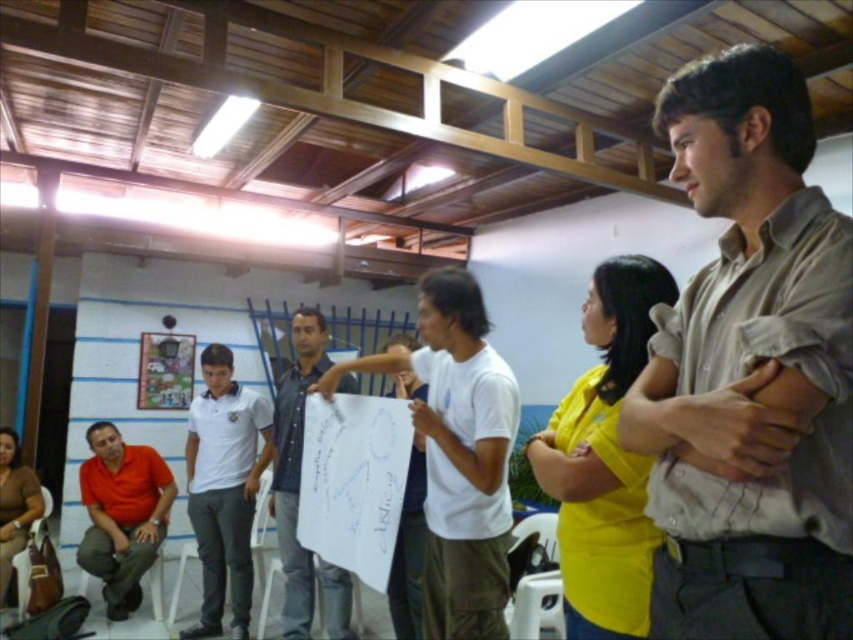
Consider the image. You are standing in the room and want to hand a document to the person wearing the light brown shirt at center. There is a brown leather purse at lower left in the way. Can you reach the person without moving the purse?

The light brown shirt at center is closer to the viewer than the brown leather purse at lower left, so you can reach the person without moving the purse because the purse is behind them.

You are organizing a small event and need to know if the yellow matte shirt at center can be seated next to the brown leather purse at lower left without overcrowding. Based on their sizes, would they fit comfortably side by side?

The yellow matte shirt at center is wider than the brown leather purse at lower left. Since their combined width would depend on the available space, but the question doesn not provide specific dimensions for the seating area, it is unclear if they would fit comfortably without overcrowding. More information about the seating space is needed.

You are trying to locate the yellow matte shirt at center in a room with a whiteboard presentation. Since the brown leather purse at lower left is taller, where would you look relative to the purse?

The yellow matte shirt at center has a lesser height compared to the brown leather purse at lower left, so you would look lower than the brown leather purse at lower left to find it.